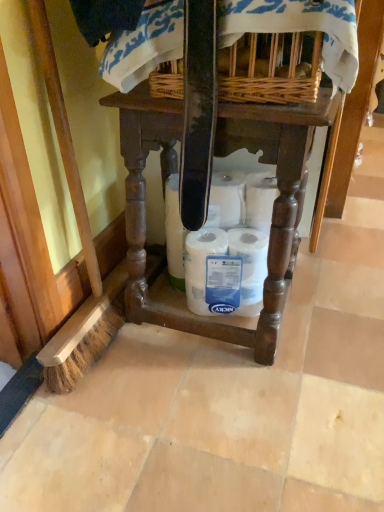
Question: In terms of height, does woven wicker basket at upper center look taller or shorter compared to white matte toilet paper at center?

Choices:
 (A) short
 (B) tall

Answer: (A)

Question: From a real-world perspective, relative to white matte toilet paper at center, is woven wicker basket at upper center vertically above or below?

Choices:
 (A) below
 (B) above

Answer: (B)

Question: Which is farther from the white matte toilet paper at center?

Choices:
 (A) woven wicker basket at upper center
 (B) wooden table at center

Answer: (A)

Question: Which is farther from the white matte toilet paper at center?

Choices:
 (A) wooden table at center
 (B) woven wicker basket at upper center

Answer: (B)